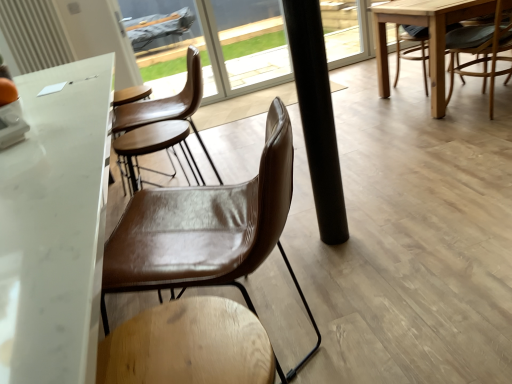
What are the coordinates of `free space in front of black matte pole at center` in the screenshot? It's located at click(348, 252).